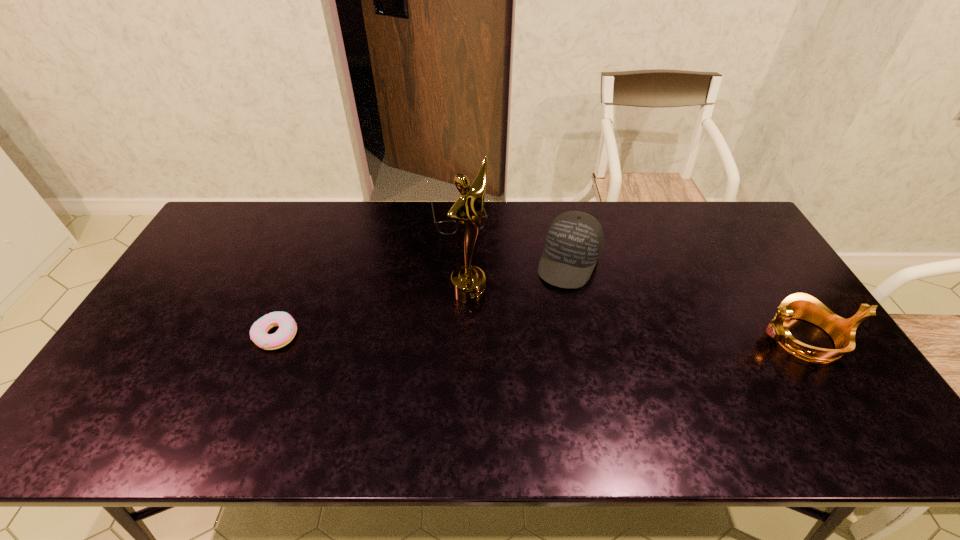
The width and height of the screenshot is (960, 540). What are the coordinates of `baseball cap at the far edge` in the screenshot? It's located at (574, 241).

You are a GUI agent. You are given a task and a screenshot of the screen. Output one action in this format:
    pyautogui.click(x=<x>, y=<y>)
    Task: Click on the spectacles present at the far edge
    The width and height of the screenshot is (960, 540).
    Given the screenshot: What is the action you would take?
    pyautogui.click(x=448, y=227)

Where is `object that is at the right edge`? object that is at the right edge is located at coordinates (799, 305).

Find the location of `vacant space at the far edge`. vacant space at the far edge is located at coordinates (672, 212).

At what (x,y) coordinates should I click in order to perform the action: click on vacant space at the near edge of the desktop. Please return your answer as a coordinate pair (x, y). The width and height of the screenshot is (960, 540). Looking at the image, I should click on (191, 381).

The image size is (960, 540). I want to click on free location at the left edge, so click(x=201, y=285).

At what (x,y) coordinates should I click in order to perform the action: click on free space at the right edge. Please return your answer as a coordinate pair (x, y). The width and height of the screenshot is (960, 540). Looking at the image, I should click on pyautogui.click(x=720, y=249).

Locate an element on the screen. The width and height of the screenshot is (960, 540). vacant area at the far right corner of the desktop is located at coordinates (709, 233).

I want to click on empty location between the doughnut and the rightmost object, so click(x=540, y=336).

The height and width of the screenshot is (540, 960). I want to click on unoccupied position between the spectacles and the shortest object, so click(x=368, y=276).